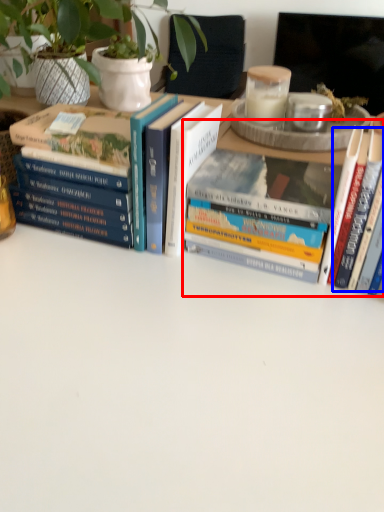
Question: Which of the following is the farthest to the observer, book (highlighted by a red box) or book (highlighted by a blue box)?

Choices:
 (A) book
 (B) book

Answer: (A)